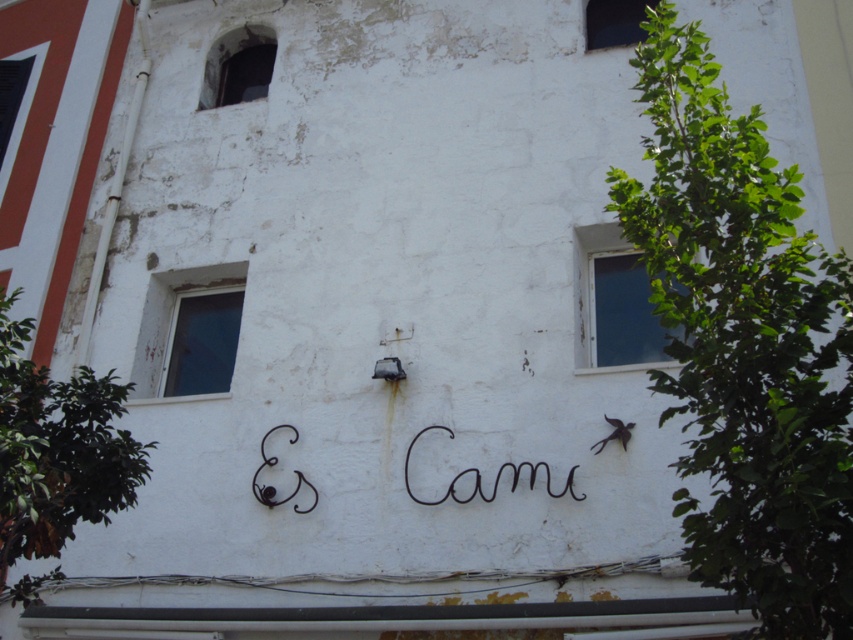
You are an architect examining the building facade. You notice the white painted wood window at upper left and the dark glass window at upper left. Which window is located to the left of the other?

The white painted wood window at upper left is positioned on the left side of dark glass window at upper left.

You are an architect designing a new building and want to ensure there is enough space between the white painted wood window at upper left and the dark glass window at upper left for a structural support beam. The beam requires at least 2 meters of space between them. Based on the image, is the current spacing sufficient?

The white painted wood window at upper left is 2.53 meters from the dark glass window at upper left, which is more than the required 2 meters. Therefore, the spacing is sufficient for the structural support beam.

You are an architect assessing the building facade. You need to determine which window is wider for structural analysis. Which window has a greater width between the white painted wood window at upper left and the dark glass window at upper left?

The white painted wood window at upper left has a greater width than the dark glass window at upper left according to the description.